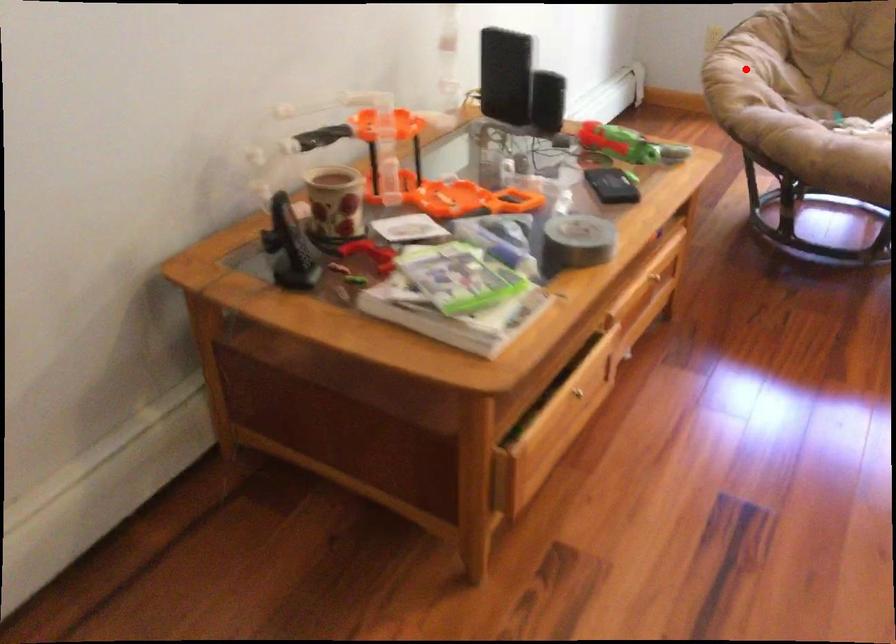
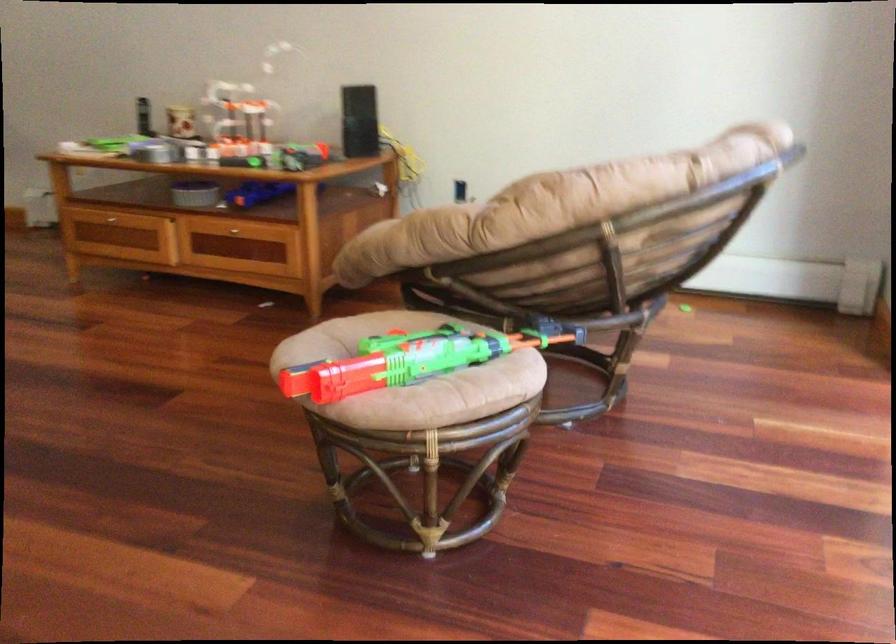
Question: I am providing you with two images of the same scene from different viewpoints. A red point is marked on the first image. At the location where the point appears in image 1, is it still visible in image 2?

Choices:
 (A) Yes
 (B) No

Answer: (B)